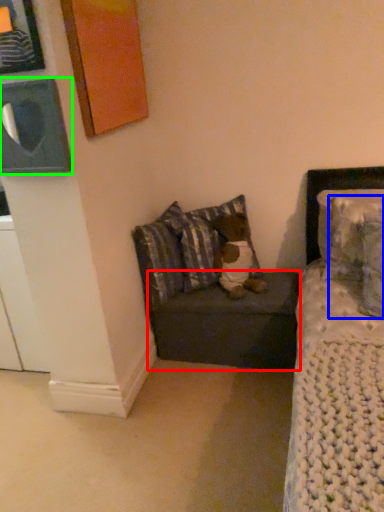
Question: Estimate the real-world distances between objects in this image. Which object is closer to table (highlighted by a red box), pillow (highlighted by a blue box) or picture frame (highlighted by a green box)?

Choices:
 (A) pillow
 (B) picture frame

Answer: (A)